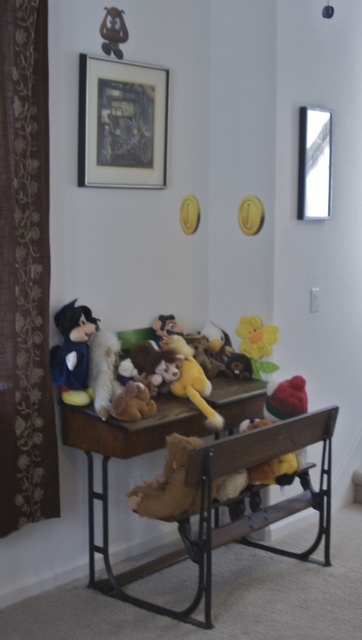
Question: Does matte blue plush at left have a greater width compared to fluffy yellow stuffed animal at center?

Choices:
 (A) yes
 (B) no

Answer: (B)

Question: Which object appears farthest from the camera in this image?

Choices:
 (A) soft plush toys at center
 (B) fluffy yellow stuffed animal at center
 (C) yellow fabric flower at center
 (D) matte brown teddy bear at upper left

Answer: (C)

Question: Which of these objects is positioned closest to the wooden desk at center?

Choices:
 (A) matte black picture frame at upper center
 (B) matte brown teddy bear at upper left

Answer: (A)

Question: Is brown floral fabric curtain at left smaller than yellow fabric flower at center?

Choices:
 (A) no
 (B) yes

Answer: (A)

Question: Can you confirm if matte blue plush at left is positioned to the right of yellow fabric flower at center?

Choices:
 (A) no
 (B) yes

Answer: (A)

Question: Which object is closer to the camera taking this photo?

Choices:
 (A) matte blue plush at left
 (B) metallic rectangular frame at upper right

Answer: (A)